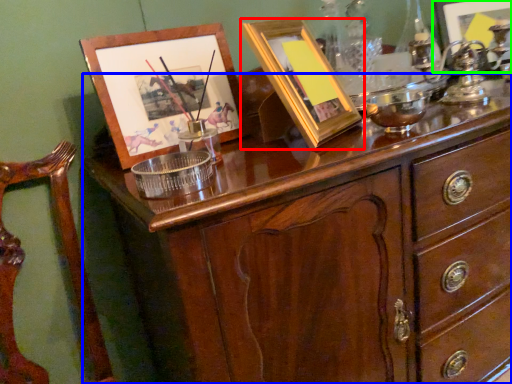
Question: Considering the real-world distances, which object is closest to picture frame (highlighted by a red box)? chest of drawers (highlighted by a blue box) or picture frame (highlighted by a green box).

Choices:
 (A) chest of drawers
 (B) picture frame

Answer: (A)